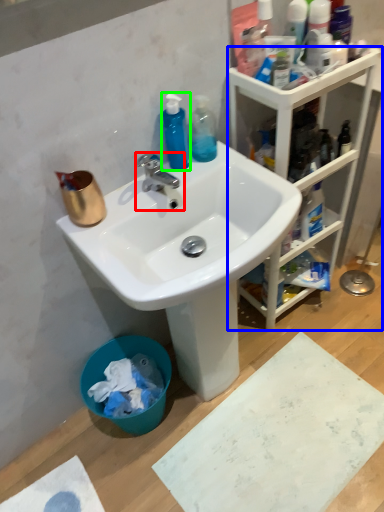
Question: Which object is the closest to the tap (highlighted by a red box)? Choose among these: cabinetry (highlighted by a blue box) or cleaning product (highlighted by a green box).

Choices:
 (A) cabinetry
 (B) cleaning product

Answer: (B)